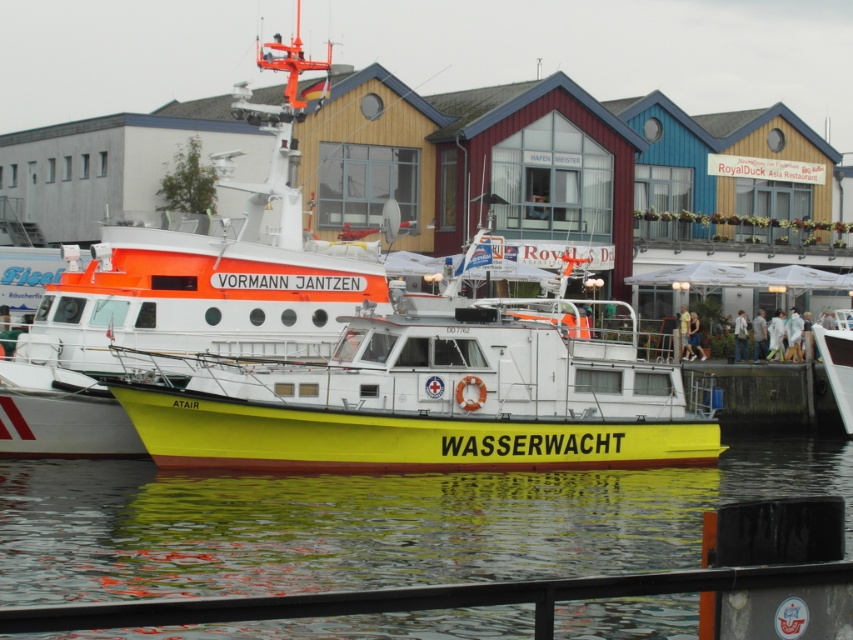
Question: Where is yellow matte boat at center located in relation to white fabric jacket at center in the image?

Choices:
 (A) below
 (B) above

Answer: (B)

Question: Which is nearer to the yellow matte boat at center?

Choices:
 (A) white fabric shirt at right
 (B) orange matte rescue boat at center
 (C) white fabric jacket at center

Answer: (B)

Question: Can you confirm if yellow matte boat at center is wider than white fabric jacket at center?

Choices:
 (A) no
 (B) yes

Answer: (B)

Question: Which object appears farthest from the camera in this image?

Choices:
 (A) yellow matte water at lower center
 (B) yellow matte boat at center

Answer: (B)

Question: Among these objects, which one is farthest from the camera?

Choices:
 (A) yellow matte water at lower center
 (B) orange matte rescue boat at center
 (C) yellow fabric person at right

Answer: (C)

Question: Is white fabric person at lower right closer to the viewer compared to white fabric shirt at right?

Choices:
 (A) yes
 (B) no

Answer: (A)